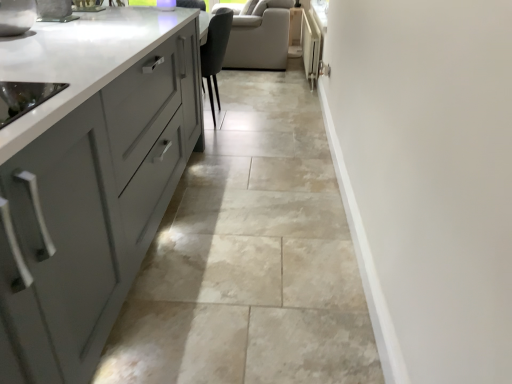
Question: Is white glossy radiator at upper right at the left side of natural stone floor at center?

Choices:
 (A) no
 (B) yes

Answer: (A)

Question: Is white glossy radiator at upper right positioned with its back to natural stone floor at center?

Choices:
 (A) no
 (B) yes

Answer: (A)

Question: From a real-world perspective, is white glossy radiator at upper right physically above natural stone floor at center?

Choices:
 (A) no
 (B) yes

Answer: (B)

Question: Can natural stone floor at center be found inside white glossy radiator at upper right?

Choices:
 (A) yes
 (B) no

Answer: (B)

Question: Considering the relative positions of white glossy radiator at upper right and natural stone floor at center in the image provided, is white glossy radiator at upper right behind natural stone floor at center?

Choices:
 (A) yes
 (B) no

Answer: (A)

Question: Can you confirm if white glossy radiator at upper right is taller than natural stone floor at center?

Choices:
 (A) yes
 (B) no

Answer: (A)

Question: Can you confirm if natural stone floor at center is positioned to the left of white glossy radiator at upper right?

Choices:
 (A) no
 (B) yes

Answer: (B)

Question: From the image's perspective, is natural stone floor at center under white glossy radiator at upper right?

Choices:
 (A) yes
 (B) no

Answer: (A)

Question: Considering the relative positions of natural stone floor at center and white glossy radiator at upper right in the image provided, is natural stone floor at center behind white glossy radiator at upper right?

Choices:
 (A) yes
 (B) no

Answer: (B)

Question: Considering the relative sizes of natural stone floor at center and white glossy radiator at upper right in the image provided, is natural stone floor at center bigger than white glossy radiator at upper right?

Choices:
 (A) no
 (B) yes

Answer: (B)

Question: Can you confirm if natural stone floor at center is shorter than white glossy radiator at upper right?

Choices:
 (A) yes
 (B) no

Answer: (A)

Question: Does natural stone floor at center have a greater height compared to white glossy radiator at upper right?

Choices:
 (A) yes
 (B) no

Answer: (B)

Question: Looking at their shapes, would you say white glossy radiator at upper right is wider or thinner than natural stone floor at center?

Choices:
 (A) thin
 (B) wide

Answer: (A)